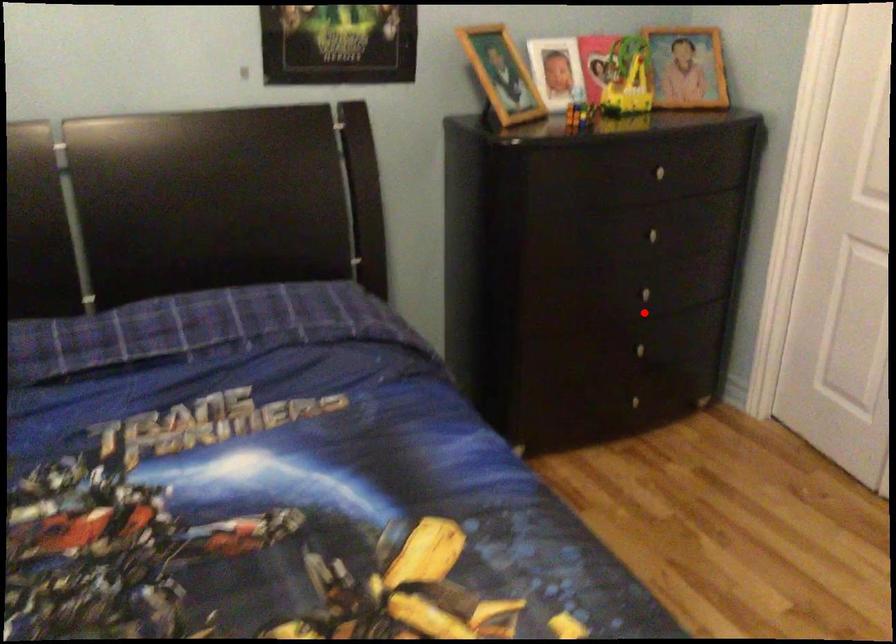
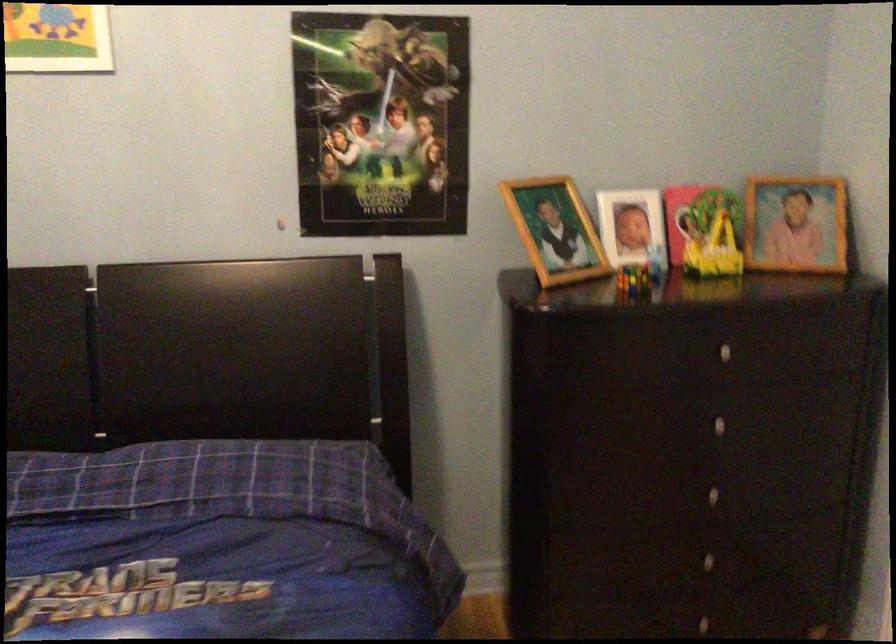
Question: I am providing you with two images of the same scene from different viewpoints. A red point is shown in image1. For the corresponding object point in image2, is it positioned nearer or farther from the camera?

Choices:
 (A) Nearer
 (B) Farther

Answer: (A)